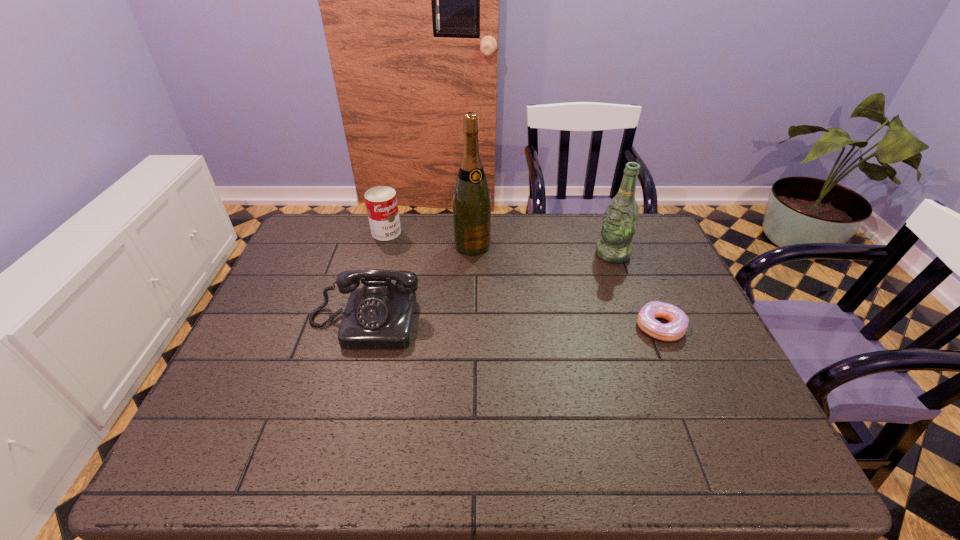
Identify the location of object at the left edge. (380, 315).

This screenshot has width=960, height=540. I want to click on doughnut present at the right edge, so click(x=678, y=323).

Where is `beer bottle that is at the right edge`? Image resolution: width=960 pixels, height=540 pixels. beer bottle that is at the right edge is located at coordinates (620, 219).

At what (x,y) coordinates should I click in order to perform the action: click on object at the far right corner. Please return your answer as a coordinate pair (x, y). The image size is (960, 540). Looking at the image, I should click on (620, 219).

This screenshot has width=960, height=540. What are the coordinates of `free space at the far edge of the desktop` in the screenshot? It's located at (375, 246).

The width and height of the screenshot is (960, 540). In the image, there is a desktop. Find the location of `free region at the near edge`. free region at the near edge is located at coordinates (306, 392).

The image size is (960, 540). Identify the location of vacant space at the left edge of the desktop. (268, 302).

In the image, there is a desktop. In order to click on vacant region at the right edge in this screenshot , I will do `click(664, 297)`.

Locate an element on the screen. This screenshot has height=540, width=960. vacant position at the far left corner of the desktop is located at coordinates (345, 224).

This screenshot has height=540, width=960. Find the location of `blank region between the third object from left to right and the telephone`. blank region between the third object from left to right and the telephone is located at coordinates (419, 284).